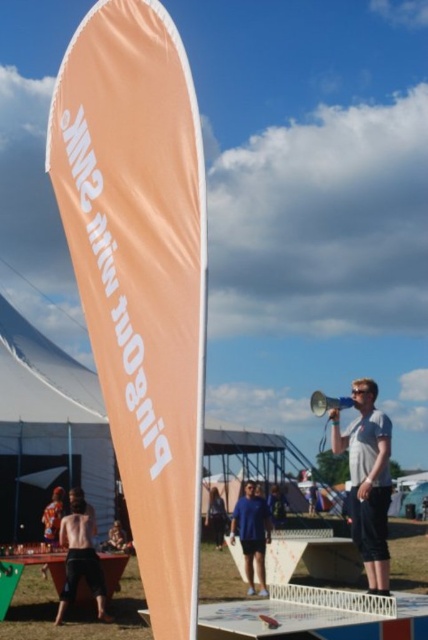
Question: Is black fabric pants at lower left above blue cotton shirt at center?

Choices:
 (A) yes
 (B) no

Answer: (A)

Question: Which object is the closest to the black fabric pants at lower left?

Choices:
 (A) orange fabric banner at left
 (B) orange fabric canopy at left
 (C) metallic silver megaphone at center

Answer: (C)

Question: Is orange fabric banner at left to the left of blue cotton shirt at center from the viewer's perspective?

Choices:
 (A) no
 (B) yes

Answer: (B)

Question: Which object appears farthest from the camera in this image?

Choices:
 (A) floral fabric shirt at lower left
 (B) metallic silver megaphone at center
 (C) orange fabric canopy at left
 (D) blue cotton shirt at center

Answer: (C)

Question: Which object is positioned farthest from the floral fabric shirt at lower left?

Choices:
 (A) black fabric pants at lower left
 (B) blue cotton shirt at center
 (C) dark blue jeans at center
 (D) metallic silver megaphone at center

Answer: (D)

Question: Is orange fabric canopy at left above black fabric pants at lower left?

Choices:
 (A) yes
 (B) no

Answer: (A)